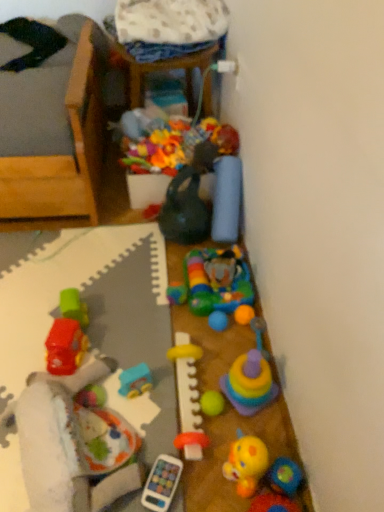
Question: Is blue plastic toy car at center, which is the second toy from left to right, positioned in front of yellow rubber teething ring at center, positioned as the eighth toy in right-to-left order?

Choices:
 (A) no
 (B) yes

Answer: (A)

Question: Is yellow rubber teething ring at center, positioned as the eighth toy in right-to-left order, a part of blue plastic toy car at center, which is the second toy from left to right?

Choices:
 (A) yes
 (B) no

Answer: (B)

Question: Are blue plastic toy car at center, positioned as the tenth toy in right-to-left order, and yellow rubber teething ring at center, positioned as the eighth toy in right-to-left order, far apart?

Choices:
 (A) yes
 (B) no

Answer: (B)

Question: Is blue plastic toy car at center, which is the second toy from left to right, to the left of yellow rubber teething ring at center, positioned as the eighth toy in right-to-left order, from the viewer's perspective?

Choices:
 (A) yes
 (B) no

Answer: (A)

Question: From a real-world perspective, is blue plastic toy car at center, positioned as the tenth toy in right-to-left order, located beneath yellow rubber teething ring at center, positioned as the eighth toy in right-to-left order?

Choices:
 (A) yes
 (B) no

Answer: (A)

Question: From a real-world perspective, is rubber duck at center, the fifth toy from the right, physically located above or below rubberized yellow duck at lower right, which is the eleventh toy from left to right?

Choices:
 (A) above
 (B) below

Answer: (A)

Question: Does point (266, 453) appear closer or farther from the camera than point (249, 508)?

Choices:
 (A) closer
 (B) farther

Answer: (B)

Question: Choose the correct answer: Is rubber duck at center, which is the 7th toy in left-to-right order, inside rubberized yellow duck at lower right, which is counted as the first toy, starting from the right, or outside it?

Choices:
 (A) outside
 (B) inside

Answer: (A)

Question: Based on their positions, is rubber duck at center, which is the 7th toy in left-to-right order, located to the left or right of rubberized yellow duck at lower right, which is the eleventh toy from left to right?

Choices:
 (A) right
 (B) left

Answer: (B)

Question: Considering the positions of rubber duck at center, which is the 7th toy in left-to-right order, and green rubber ball at center, which appears as the 5th toy when viewed from the left, in the image, is rubber duck at center, which is the 7th toy in left-to-right order, taller or shorter than green rubber ball at center, which appears as the 5th toy when viewed from the left,?

Choices:
 (A) tall
 (B) short

Answer: (A)

Question: Is rubber duck at center, which is the 7th toy in left-to-right order, wider or thinner than green rubber ball at center, which appears as the 5th toy when viewed from the left?

Choices:
 (A) thin
 (B) wide

Answer: (B)

Question: Considering their positions, is rubber duck at center, which is the 7th toy in left-to-right order, located in front of or behind green rubber ball at center, which is counted as the 7th toy, starting from the right?

Choices:
 (A) behind
 (B) front

Answer: (B)

Question: From the image's perspective, is rubber duck at center, the fifth toy from the right, located above or below green rubber ball at center, which is counted as the 7th toy, starting from the right?

Choices:
 (A) above
 (B) below

Answer: (B)

Question: Is blue fabric pillow at upper right, arranged as the 4th toy when viewed from the right, in front of or behind matte green kettle at center, marked as the ninth toy in a right-to-left arrangement, in the image?

Choices:
 (A) behind
 (B) front

Answer: (A)

Question: Looking at the image, does blue fabric pillow at upper right, arranged as the 4th toy when viewed from the right, seem bigger or smaller compared to matte green kettle at center, marked as the ninth toy in a right-to-left arrangement?

Choices:
 (A) small
 (B) big

Answer: (A)